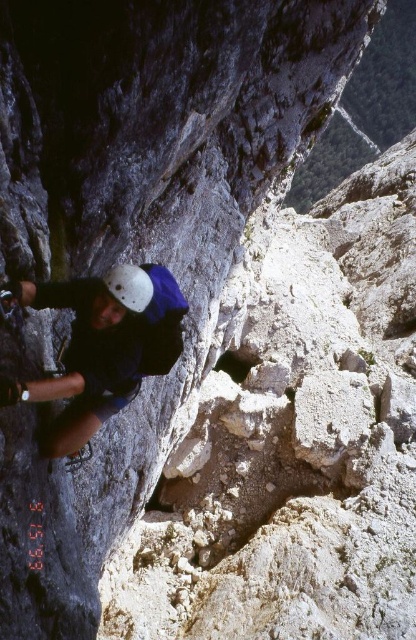
Question: Which object appears farthest from the camera in this image?

Choices:
 (A) white matte helmet at upper left
 (B) matte white helmet at left

Answer: (A)

Question: Which object is farther from the camera taking this photo?

Choices:
 (A) white matte helmet at upper left
 (B) matte white helmet at left

Answer: (A)

Question: Does matte white helmet at left have a smaller size compared to white matte helmet at upper left?

Choices:
 (A) yes
 (B) no

Answer: (B)

Question: Which object is closer to the camera taking this photo?

Choices:
 (A) white matte helmet at upper left
 (B) matte white helmet at left

Answer: (B)

Question: Observing the image, what is the correct spatial positioning of matte white helmet at left in reference to white matte helmet at upper left?

Choices:
 (A) above
 (B) below

Answer: (B)

Question: Is matte white helmet at left thinner than white matte helmet at upper left?

Choices:
 (A) yes
 (B) no

Answer: (B)